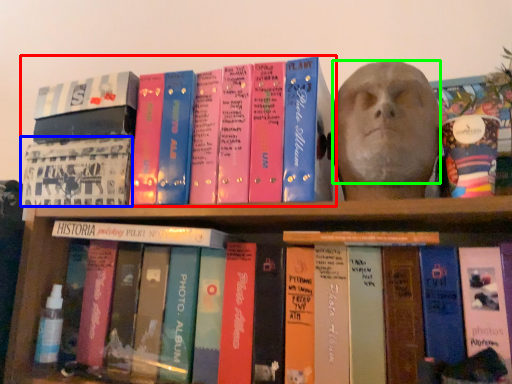
Question: Which is farther away from book (highlighted by a red box)? book cover (highlighted by a blue box) or human face (highlighted by a green box)?

Choices:
 (A) book cover
 (B) human face

Answer: (B)